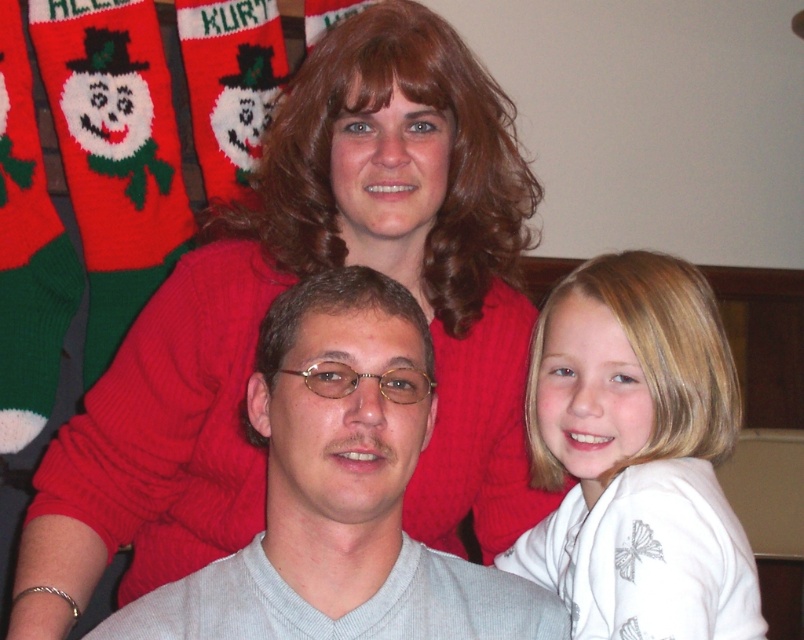
You are taking a family photo and need to arrange the two main subjects based on their clothing. The gray knit sweater at center and the white satin shirt at right are part of the setup. Which clothing item should be placed to the left side of the frame to maintain the current arrangement?

The gray knit sweater at center should be placed to the left side of the frame because it is already positioned to the left of the white satin shirt at right in the current arrangement.

Based on the photo, you are a photographer adjusting the lighting for a family portrait. You need to ensure that both the gray knit sweater at center and the white satin shirt at right are well lit. Considering their positions, which clothing item should you focus the light on first to ensure it is properly illuminated?

The gray knit sweater at center is closer to the viewer than the white satin shirt at right, so you should focus the light on the gray knit sweater at center first to ensure proper illumination.